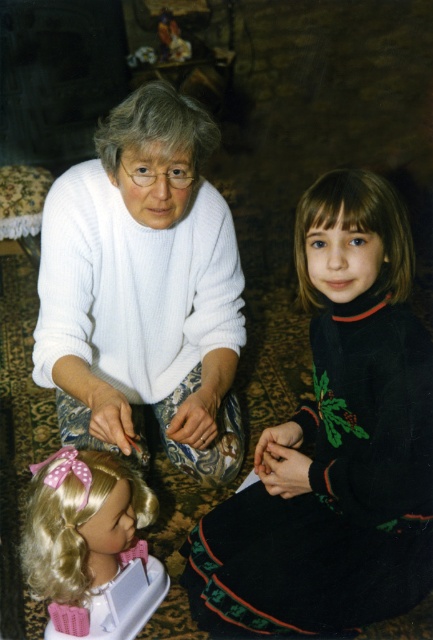
You are a photographer setting up for a family photo. You need to position the blonde hair wig at lower left and brown smooth hair at center so that they are both visible in the frame. Which wig should you adjust to ensure it doesn not block the other?

The blonde hair wig at lower left is larger in size than brown smooth hair at center, so you should adjust the larger blonde hair wig at lower left to prevent it from blocking the smaller brown smooth hair at center.

You are a photographer setting up a shot in this living room scene. You need to place a small prop exactly at the coordinates where the white knitted sweater at center is located. What are the coordinates you should use?

The coordinates for the white knitted sweater at center are at point (144, 289).

You are standing in the living room scene and want to place a small decoration between the two points labeled point (133, 477) and point (351, 176). Which point should the decoration be closer to in order to be nearer to the viewer?

The decoration should be closer to point (133, 477) because it is closer to the viewer than point (351, 176).